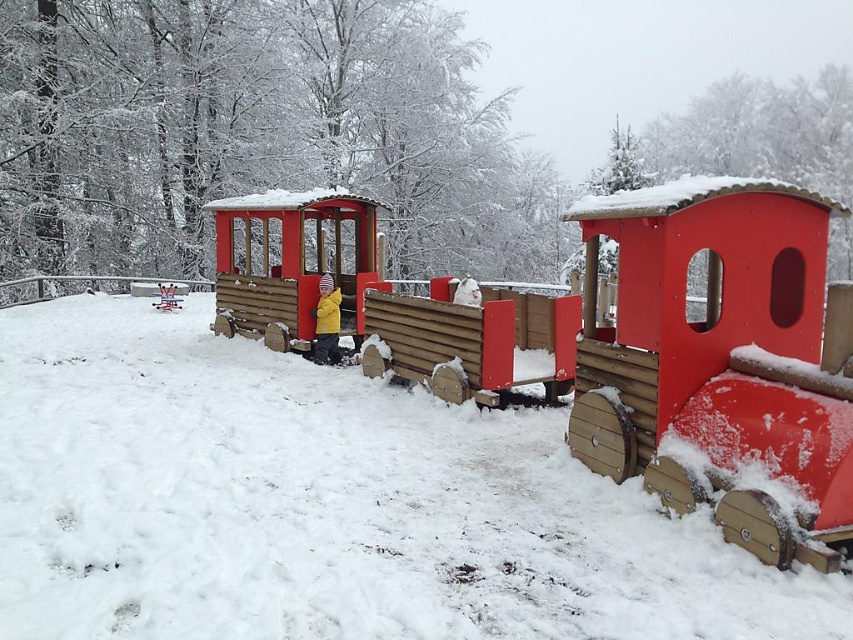
Identify the location of wooden train at center. (675, 356).

Does wooden train at center have a smaller size compared to wooden train car at center?

Actually, wooden train at center might be larger than wooden train car at center.

This screenshot has width=853, height=640. Find the location of `wooden train at center`. wooden train at center is located at coordinates (675, 356).

The height and width of the screenshot is (640, 853). I want to click on wooden train at center, so click(x=675, y=356).

Can you confirm if wooden train at center is bigger than yellow fleece jacket at center?

Yes.

Is point (451, 291) farther from viewer compared to point (320, 333)?

No, (451, 291) is closer to viewer.

Find the location of a particular element. Image resolution: width=853 pixels, height=640 pixels. wooden train at center is located at coordinates (675, 356).

At what (x,y) coordinates should I click in order to perform the action: click on wooden train at center. Please return your answer as a coordinate pair (x, y). This screenshot has height=640, width=853. Looking at the image, I should click on (675, 356).

Is point (302, 280) closer to camera compared to point (329, 305)?

No.

Does point (315, 260) come behind point (334, 356)?

Yes, it is behind point (334, 356).

The width and height of the screenshot is (853, 640). What are the coordinates of `wooden train car at center` in the screenshot? It's located at (294, 266).